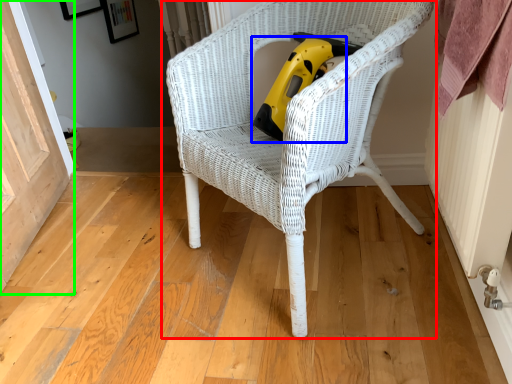
Question: Which is farther away from chair (highlighted by a red box)? vacuum (highlighted by a blue box) or screen door (highlighted by a green box)?

Choices:
 (A) vacuum
 (B) screen door

Answer: (B)